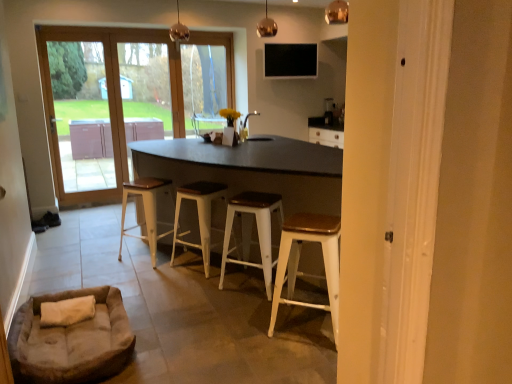
Measure the distance between point (302, 53) and camera.

The distance of point (302, 53) from camera is 20.27 feet.

What do you see at coordinates (125, 98) in the screenshot? The width and height of the screenshot is (512, 384). I see `wooden door at left` at bounding box center [125, 98].

Identify the location of matte black sink at center. (247, 130).

The height and width of the screenshot is (384, 512). I want to click on wooden seat white stool at center, the first stool from the left, so click(x=146, y=210).

This screenshot has height=384, width=512. I want to click on white wood stool at center, positioned as the third stool in right-to-left order, so [x=198, y=215].

What do you see at coordinates (251, 231) in the screenshot? I see `wooden seat white metal stool at center, marked as the third stool in a left-to-right arrangement` at bounding box center [251, 231].

This screenshot has width=512, height=384. Find the location of `black matte tv at upper center`. black matte tv at upper center is located at coordinates (290, 60).

Is white wood stool at center, positioned as the third stool in right-to-left order, facing away from white metal stool at lower right, the fourth stool positioned from the left?

No, white wood stool at center, positioned as the third stool in right-to-left order, is not facing the opposite direction of white metal stool at lower right, the fourth stool positioned from the left.

In terms of width, does white wood stool at center, positioned as the third stool in right-to-left order, look wider or thinner when compared to white metal stool at lower right, the fourth stool positioned from the left?

Considering their sizes, white wood stool at center, positioned as the third stool in right-to-left order, looks broader than white metal stool at lower right, the fourth stool positioned from the left.

Is white metal stool at lower right, the fourth stool positioned from the left, surrounded by white wood stool at center, positioned as the third stool in right-to-left order?

No, white metal stool at lower right, the fourth stool positioned from the left, is located outside of white wood stool at center, positioned as the third stool in right-to-left order.

From the image's perspective, is white metal stool at lower right, which is the 1th stool from right to left, on top of wooden seat white stool at center, the first stool from the left?

Incorrect, from the image's perspective, white metal stool at lower right, which is the 1th stool from right to left, is lower than wooden seat white stool at center, the first stool from the left.

From a real-world perspective, is white metal stool at lower right, the fourth stool positioned from the left, positioned above or below wooden seat white stool at center, the first stool from the left?

white metal stool at lower right, the fourth stool positioned from the left, is above wooden seat white stool at center, the first stool from the left.

Which is more to the right, white metal stool at lower right, the fourth stool positioned from the left, or wooden seat white stool at center, the first stool from the left?

Positioned to the right is white metal stool at lower right, the fourth stool positioned from the left.

Between white metal stool at lower right, the fourth stool positioned from the left, and wooden seat white stool at center, the 4th stool when ordered from right to left, which one is positioned in front?

white metal stool at lower right, the fourth stool positioned from the left.

Based on the photo, from the image's perspective, between suede beige dog bed at lower left and black matte tv at upper center, which one is located above?

From the image's view, black matte tv at upper center is above.

Can you confirm if suede beige dog bed at lower left is shorter than black matte tv at upper center?

Correct, suede beige dog bed at lower left is not as tall as black matte tv at upper center.

Is suede beige dog bed at lower left directly adjacent to black matte tv at upper center?

No.

From the picture: Measure the distance from suede beige dog bed at lower left to black matte tv at upper center.

A distance of 4.62 meters exists between suede beige dog bed at lower left and black matte tv at upper center.

Considering the relative sizes of wooden seat white stool at center, the first stool from the left, and black matte tv at upper center in the image provided, is wooden seat white stool at center, the first stool from the left, shorter than black matte tv at upper center?

No, wooden seat white stool at center, the first stool from the left, is not shorter than black matte tv at upper center.

How different are the orientations of wooden seat white stool at center, the 4th stool when ordered from right to left, and black matte tv at upper center in degrees?

They differ by 136 degrees in their facing directions.

Is wooden seat white stool at center, the 4th stool when ordered from right to left, touching black matte tv at upper center?

No, wooden seat white stool at center, the 4th stool when ordered from right to left, is not with black matte tv at upper center.

Is black matte tv at upper center oriented towards wooden door at left?

No, black matte tv at upper center does not turn towards wooden door at left.

Does black matte tv at upper center touch wooden door at left?

black matte tv at upper center and wooden door at left are not in contact.

Is black matte tv at upper center positioned beyond the bounds of wooden door at left?

Absolutely, black matte tv at upper center is external to wooden door at left.

Considering the sizes of objects matte black sink at center and wooden door at left in the image provided, who is taller, matte black sink at center or wooden door at left?

With more height is wooden door at left.

Is point (240, 122) in front of point (58, 119)?

Yes, it is in front of point (58, 119).

Is matte black sink at center facing away from wooden door at left?

No, wooden door at left is not at the back of matte black sink at center.

Can you confirm if wooden seat white stool at center, the 4th stool when ordered from right to left, is shorter than white wood stool at center, the 2th stool in the left-to-right sequence?

Indeed, wooden seat white stool at center, the 4th stool when ordered from right to left, has a lesser height compared to white wood stool at center, the 2th stool in the left-to-right sequence.

Is wooden seat white stool at center, the 4th stool when ordered from right to left, facing away from white wood stool at center, positioned as the third stool in right-to-left order?

wooden seat white stool at center, the 4th stool when ordered from right to left, is not turned away from white wood stool at center, positioned as the third stool in right-to-left order.

Which object is positioned more to the left, wooden seat white stool at center, the 4th stool when ordered from right to left, or white wood stool at center, the 2th stool in the left-to-right sequence?

wooden seat white stool at center, the 4th stool when ordered from right to left.

Find the location of a particular element. stool that is the 2nd one when counting rightward from the white wood stool at center, positioned as the third stool in right-to-left order is located at coordinates (298, 258).

There is a white metal stool at lower right, the fourth stool positioned from the left. At what (x,y) coordinates should I click in order to perform the action: click on the 2nd stool below it (from a real-world perspective). Please return your answer as a coordinate pair (x, y). Looking at the image, I should click on 146,210.

Based on their spatial positions, is wooden door at left or white wood stool at center, positioned as the third stool in right-to-left order, further from black matte tv at upper center?

Among the two, white wood stool at center, positioned as the third stool in right-to-left order, is located further to black matte tv at upper center.

When comparing their distances from matte black sink at center, does black matte tv at upper center or wooden door at left seem closer?

Among the two, wooden door at left is located nearer to matte black sink at center.

Looking at the image, which one is located closer to black matte tv at upper center, white wood stool at center, the 2th stool in the left-to-right sequence, or white metal stool at lower right, which is the 1th stool from right to left?

The object closer to black matte tv at upper center is white wood stool at center, the 2th stool in the left-to-right sequence.

When comparing their distances from wooden door at left, does suede beige dog bed at lower left or black matte tv at upper center seem further?

suede beige dog bed at lower left lies further to wooden door at left than the other object.

Based on their spatial positions, is wooden seat white stool at center, the first stool from the left, or wooden door at left further from suede beige dog bed at lower left?

wooden door at left.

Estimate the real-world distances between objects in this image. Which object is closer to wooden seat white stool at center, the first stool from the left, suede beige dog bed at lower left or white metal stool at lower right, the fourth stool positioned from the left?

Among the two, suede beige dog bed at lower left is located nearer to wooden seat white stool at center, the first stool from the left.

From the image, which object appears to be farther from wooden seat white metal stool at center, marked as the second stool in a right-to-left arrangement, black matte tv at upper center or white wood stool at center, positioned as the third stool in right-to-left order?

The object further to wooden seat white metal stool at center, marked as the second stool in a right-to-left arrangement, is black matte tv at upper center.

Considering their positions, is matte black sink at center positioned further to suede beige dog bed at lower left than wooden door at left?

wooden door at left is further to suede beige dog bed at lower left.

This screenshot has height=384, width=512. Find the location of `sink between wooden seat white metal stool at center, marked as the second stool in a right-to-left arrangement, and black matte tv at upper center, along the z-axis`. sink between wooden seat white metal stool at center, marked as the second stool in a right-to-left arrangement, and black matte tv at upper center, along the z-axis is located at coordinates (247, 130).

Locate an element on the screen. Image resolution: width=512 pixels, height=384 pixels. door positioned between white wood stool at center, positioned as the third stool in right-to-left order, and black matte tv at upper center from near to far is located at coordinates (125, 98).

Identify the location of door between white metal stool at lower right, which is the 1th stool from right to left, and black matte tv at upper center from front to back. (125, 98).

This screenshot has width=512, height=384. In order to click on sink between wooden seat white stool at center, the 4th stool when ordered from right to left, and black matte tv at upper center from front to back in this screenshot , I will do `click(247, 130)`.